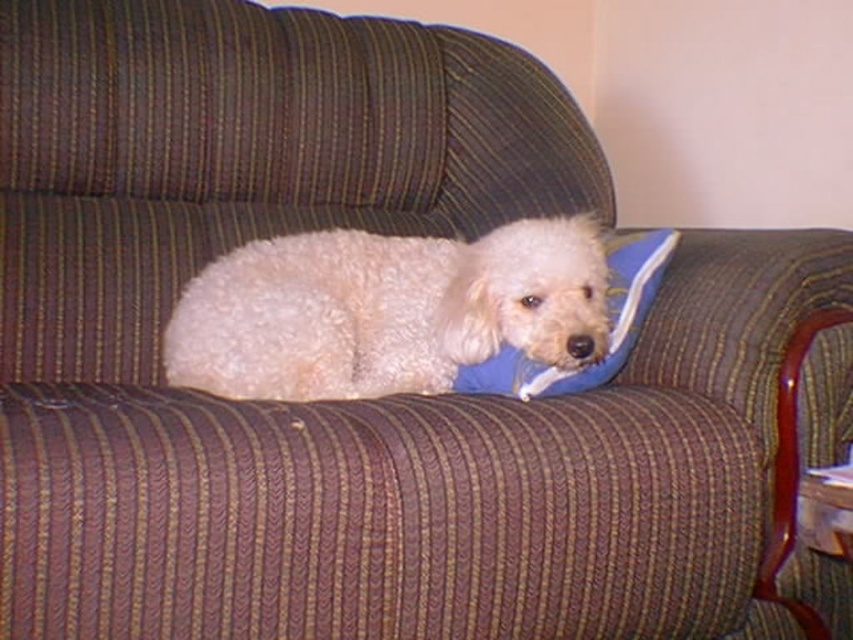
Which is in front, point (210, 371) or point (508, 381)?

Point (508, 381)

Who is lower down, white fluffy dog at center or blue fabric pillow at center?

Positioned lower is blue fabric pillow at center.

I want to click on white fluffy dog at center, so click(386, 310).